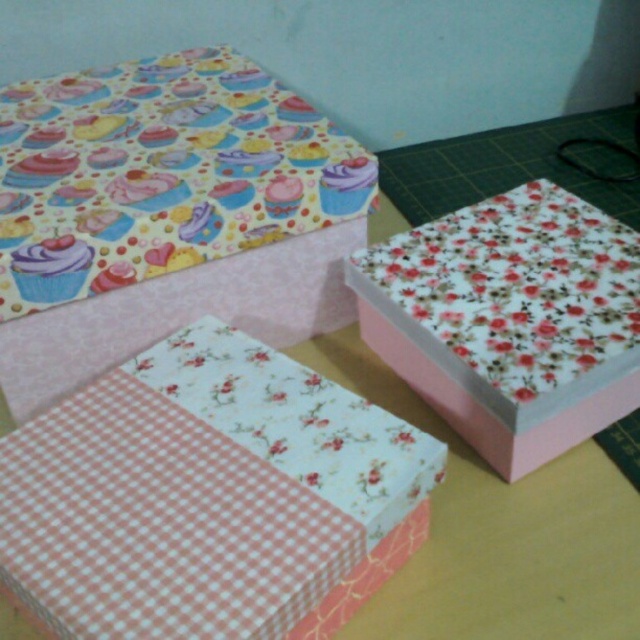
Question: Can you confirm if floral-patterned paper at center-right is positioned above purple glossy cupcake at upper left?

Choices:
 (A) yes
 (B) no

Answer: (B)

Question: Among these objects, which one is farthest from the camera?

Choices:
 (A) floral-patterned paper at center-right
 (B) pink checkered paper at lower left
 (C) cupcake-patterned fabric at upper left
 (D) purple glossy cupcake at upper left

Answer: (D)

Question: Which point is farther to the camera?

Choices:
 (A) purple glossy cupcake at upper left
 (B) cupcake-patterned fabric at upper left
 (C) floral-patterned paper at center-right
 (D) pink checkered paper at lower left

Answer: (A)

Question: Can you confirm if pink checkered paper at lower left is wider than floral-patterned paper at center-right?

Choices:
 (A) no
 (B) yes

Answer: (B)

Question: Among these points, which one is nearest to the camera?

Choices:
 (A) (19, 259)
 (B) (321, 138)
 (C) (481, 376)
 (D) (120, 419)

Answer: (D)

Question: Does pink checkered paper at lower left lie behind floral-patterned paper at center-right?

Choices:
 (A) yes
 (B) no

Answer: (B)